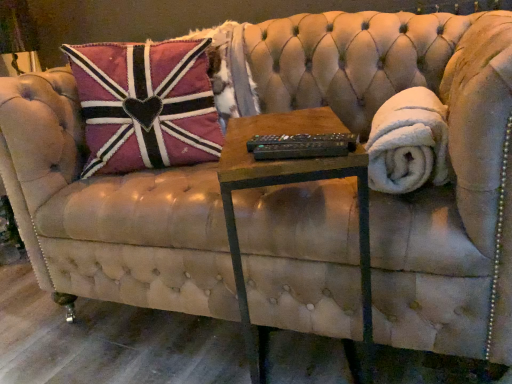
Question: Would you say white fluffy blanket at right is outside woodenmaterial/texturetable at center?

Choices:
 (A) no
 (B) yes

Answer: (B)

Question: Is white fluffy blanket at right placed right next to woodenmaterial/texturetable at center?

Choices:
 (A) yes
 (B) no

Answer: (B)

Question: Does white fluffy blanket at right have a lesser height compared to woodenmaterial/texturetable at center?

Choices:
 (A) yes
 (B) no

Answer: (A)

Question: Is white fluffy blanket at right positioned before woodenmaterial/texturetable at center?

Choices:
 (A) yes
 (B) no

Answer: (B)

Question: Does white fluffy blanket at right have a smaller size compared to woodenmaterial/texturetable at center?

Choices:
 (A) no
 (B) yes

Answer: (B)

Question: Considering the relative sizes of white fluffy blanket at right and woodenmaterial/texturetable at center in the image provided, is white fluffy blanket at right thinner than woodenmaterial/texturetable at center?

Choices:
 (A) no
 (B) yes

Answer: (B)

Question: Considering the relative sizes of woodenmaterial/texturetable at center and white fluffy blanket at right in the image provided, is woodenmaterial/texturetable at center thinner than white fluffy blanket at right?

Choices:
 (A) yes
 (B) no

Answer: (B)

Question: Can you confirm if woodenmaterial/texturetable at center is positioned to the left of white fluffy blanket at right?

Choices:
 (A) yes
 (B) no

Answer: (A)

Question: Considering the relative sizes of woodenmaterial/texturetable at center and white fluffy blanket at right in the image provided, is woodenmaterial/texturetable at center wider than white fluffy blanket at right?

Choices:
 (A) no
 (B) yes

Answer: (B)

Question: From the image's perspective, is woodenmaterial/texturetable at center on top of white fluffy blanket at right?

Choices:
 (A) no
 (B) yes

Answer: (A)

Question: Considering the relative positions of woodenmaterial/texturetable at center and white fluffy blanket at right in the image provided, is woodenmaterial/texturetable at center to the right of white fluffy blanket at right from the viewer's perspective?

Choices:
 (A) yes
 (B) no

Answer: (B)

Question: Is woodenmaterial/texturetable at center with white fluffy blanket at right?

Choices:
 (A) yes
 (B) no

Answer: (B)

Question: From the image's perspective, is white fluffy blanket at right positioned above or below woodenmaterial/texturetable at center?

Choices:
 (A) above
 (B) below

Answer: (A)